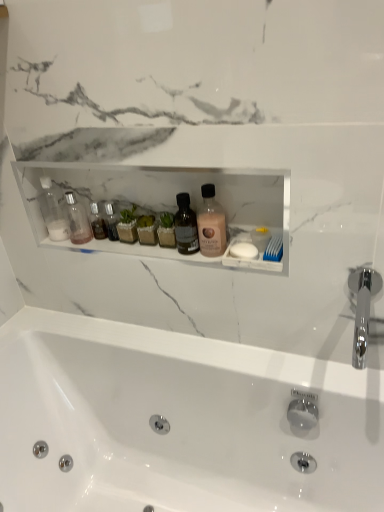
Question: Is point (59, 220) closer or farther from the camera than point (89, 239)?

Choices:
 (A) farther
 (B) closer

Answer: (A)

Question: From the image's perspective, is transparent plastic bottle at left, positioned as the 1th toiletry in left-to-right order, above or below clear glass bottle at left, the 2th toiletry when ordered from left to right?

Choices:
 (A) above
 (B) below

Answer: (A)

Question: Which object is the closest to the white glossy bathtub at center?

Choices:
 (A) clear glass bottle at left, arranged as the 1th toiletry when viewed from the right
 (B) pink matte lotion at center
 (C) white matte soap at right
 (D) chrome metallic faucet at right
 (E) transparent plastic bottle at left, which is the second toiletry in right-to-left order

Answer: (D)

Question: Which of these objects is positioned farthest from the pink matte lotion at center?

Choices:
 (A) white glossy bathtub at center
 (B) clear glass bottle at left, arranged as the 1th toiletry when viewed from the right
 (C) transparent plastic bottle at left, positioned as the 1th toiletry in left-to-right order
 (D) chrome metallic faucet at right
 (E) white matte soap at right

Answer: (A)